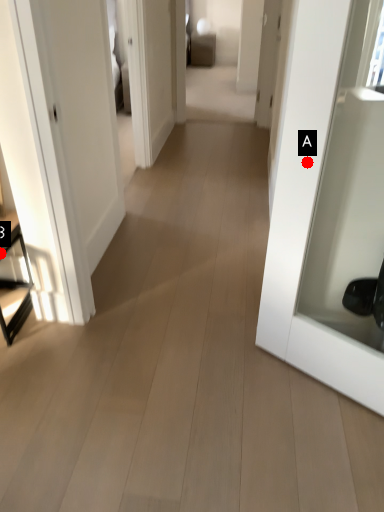
Question: Two points are circled on the image, labeled by A and B beside each circle. Which of the following is the farthest from the observer?

Choices:
 (A) A is further
 (B) B is further

Answer: (B)